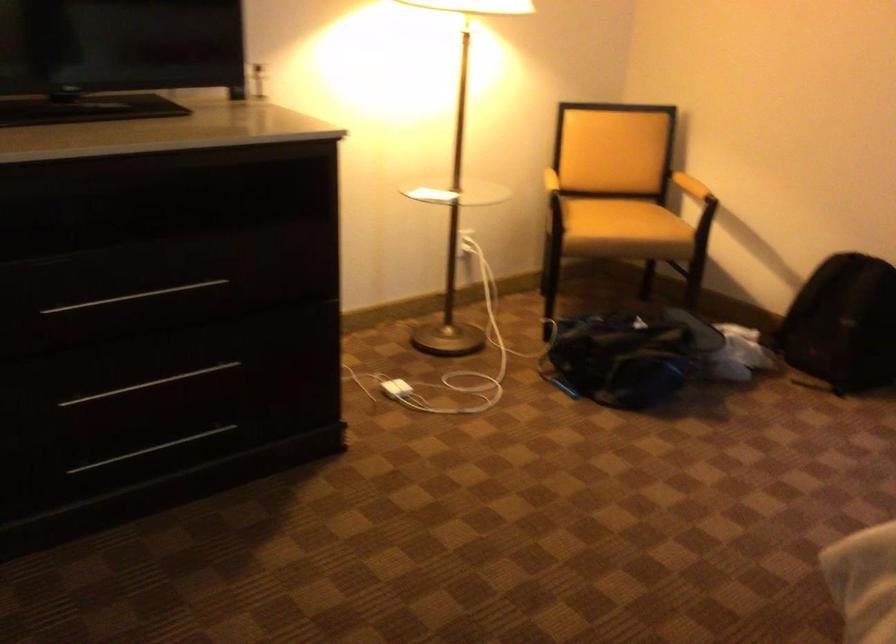
Where would you resting arm the chair armrest? Please return your answer as a coordinate pair (x, y).

(690, 185)